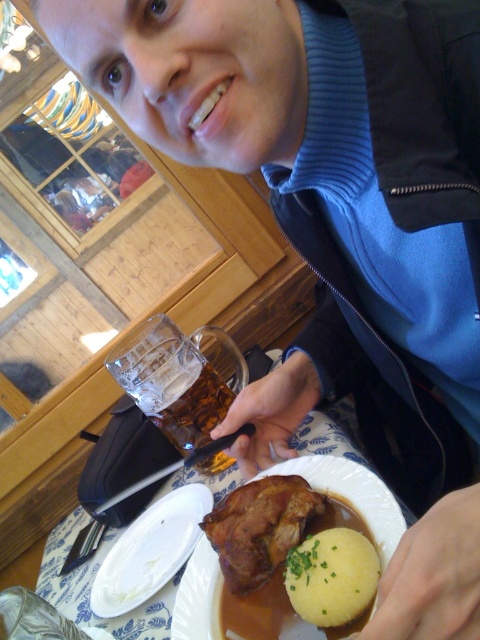
Who is taller, matte brown plate at center or white matte plate at lower left?

matte brown plate at center is taller.

I want to click on matte brown plate at center, so click(x=239, y=608).

Is point (144, 589) farther from camera compared to point (367, 580)?

Yes, point (144, 589) is behind point (367, 580).

Measure the distance from white matte plate at lower left to yellowish matte mashed potato at lower center.

white matte plate at lower left is 8.67 inches from yellowish matte mashed potato at lower center.

This screenshot has width=480, height=640. What do you see at coordinates (149, 550) in the screenshot?
I see `white matte plate at lower left` at bounding box center [149, 550].

The height and width of the screenshot is (640, 480). I want to click on white matte plate at lower left, so click(x=149, y=550).

Does matte brown plate at center appear over yellowish matte mashed potato at lower center?

Incorrect, matte brown plate at center is not positioned above yellowish matte mashed potato at lower center.

Between point (264, 476) and point (375, 579), which one is positioned in front?

Positioned in front is point (375, 579).

Is point (200, 589) positioned before point (350, 566)?

No, (200, 589) is further to viewer.

The width and height of the screenshot is (480, 640). I want to click on matte brown plate at center, so click(x=239, y=608).